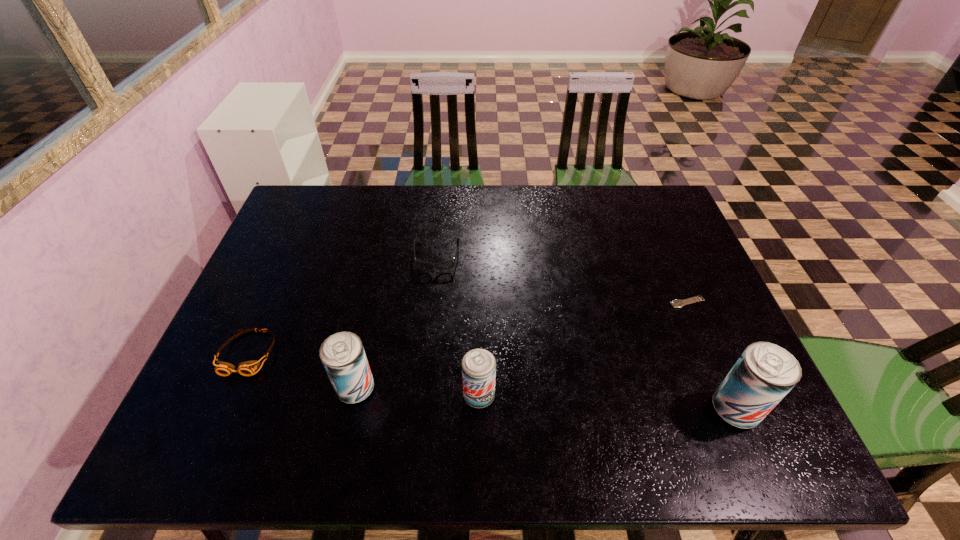
Find the location of a particular element. The width and height of the screenshot is (960, 540). object situated at the near right corner is located at coordinates (764, 374).

The image size is (960, 540). Find the location of `vacant space at the far edge of the desktop`. vacant space at the far edge of the desktop is located at coordinates (385, 191).

Find the location of `free space at the near edge`. free space at the near edge is located at coordinates (454, 410).

Where is `blank space at the left edge of the desktop`? blank space at the left edge of the desktop is located at coordinates (303, 231).

You are a GUI agent. You are given a task and a screenshot of the screen. Output one action in this format:
    pyautogui.click(x=<x>, y=<y>)
    Task: Click on the vacant space at the right edge of the desktop
    The image size is (960, 540).
    Given the screenshot: What is the action you would take?
    705,310

Find the location of `free location at the far left corner`. free location at the far left corner is located at coordinates pos(325,206).

Locate an element on the screen. free space between the second beer can from right to left and the farthest object is located at coordinates point(458,326).

Find the location of a particular element. The image size is (960, 540). empty space that is in between the rightmost beer can and the spectacles is located at coordinates (586, 333).

What are the coordinates of `vacant space that is in between the shortest beer can and the shortest object` in the screenshot? It's located at (583, 349).

I want to click on free spot between the second shortest beer can and the rightmost beer can, so click(x=545, y=399).